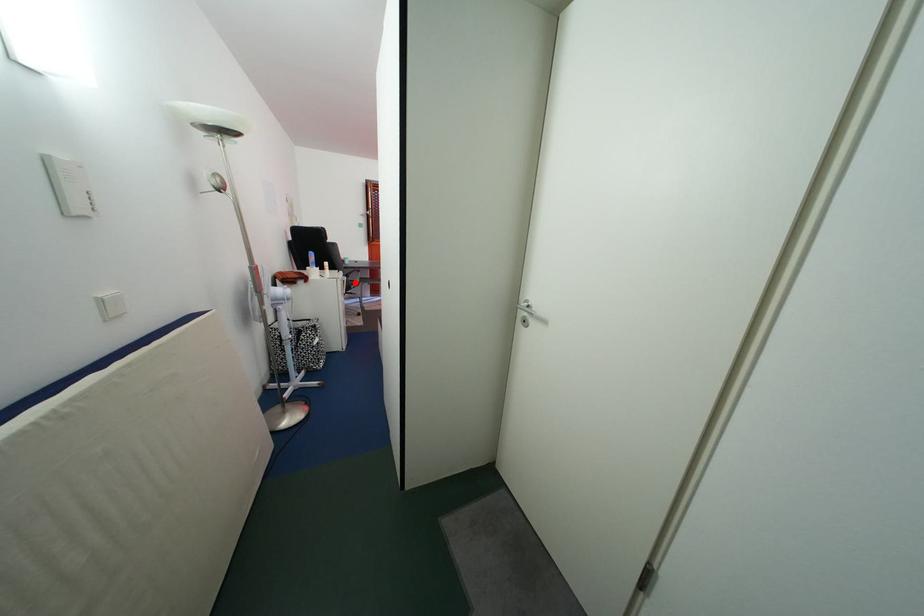
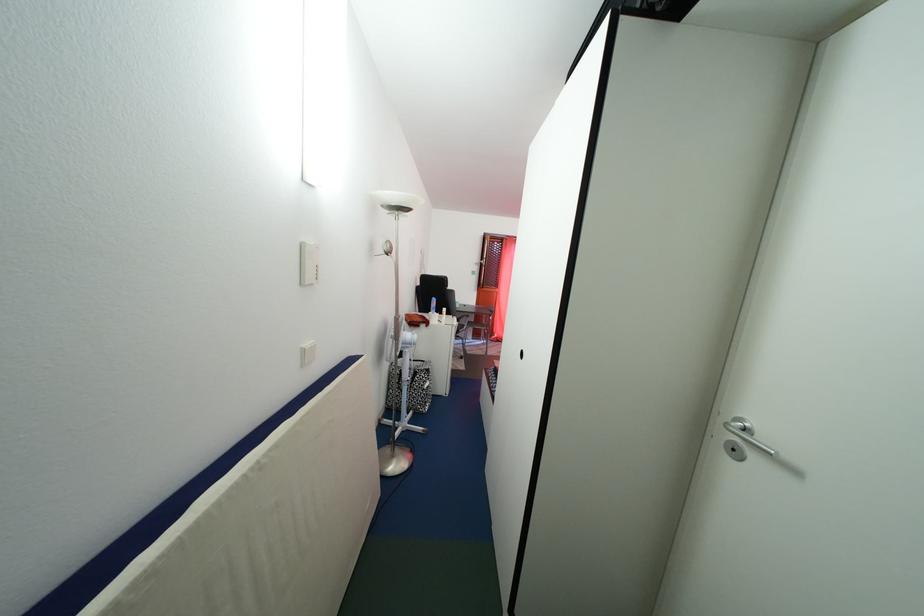
Question: I am providing you with two images of the same scene from different viewpoints. A red point is shown in image1. For the corresponding object point in image2, is it positioned nearer or farther from the camera?

Choices:
 (A) Nearer
 (B) Farther

Answer: (B)